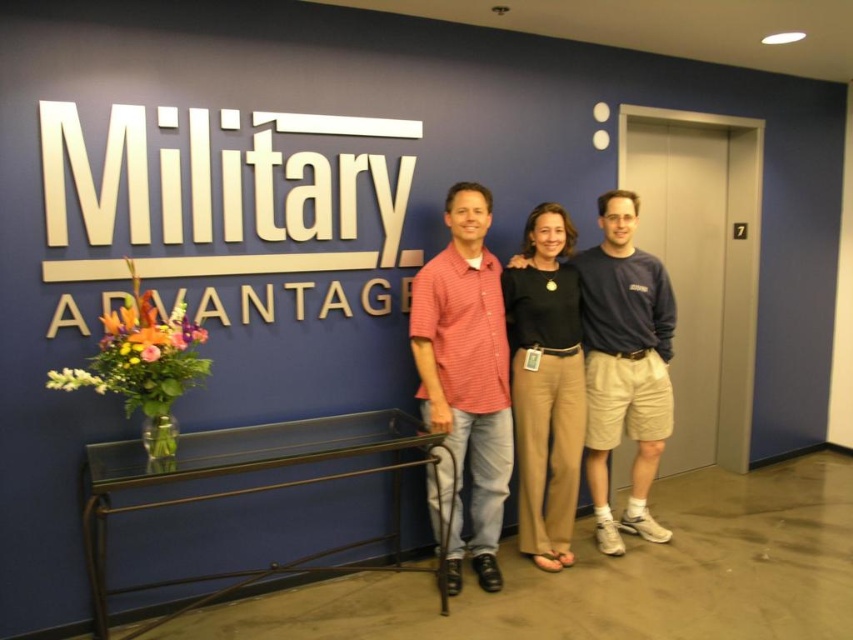
Can you confirm if blue cotton shirt at center is positioned to the right of black cotton pants at center?

Yes, blue cotton shirt at center is to the right of black cotton pants at center.

Find the location of a particular element. blue cotton shirt at center is located at coordinates (624, 365).

Locate an element on the screen. This screenshot has width=853, height=640. blue cotton shirt at center is located at coordinates (624, 365).

What do you see at coordinates (467, 364) in the screenshot? Image resolution: width=853 pixels, height=640 pixels. I see `red checkered shirt at center` at bounding box center [467, 364].

Can you confirm if red checkered shirt at center is shorter than black cotton pants at center?

No.

In order to click on red checkered shirt at center in this screenshot , I will do `click(467, 364)`.

Does red checkered shirt at center have a smaller size compared to blue cotton shirt at center?

Incorrect, red checkered shirt at center is not smaller in size than blue cotton shirt at center.

Is the position of red checkered shirt at center less distant than that of blue cotton shirt at center?

Yes, red checkered shirt at center is in front of blue cotton shirt at center.

Describe the element at coordinates (467, 364) in the screenshot. The width and height of the screenshot is (853, 640). I see `red checkered shirt at center` at that location.

Where is `red checkered shirt at center`? The image size is (853, 640). red checkered shirt at center is located at coordinates (467, 364).